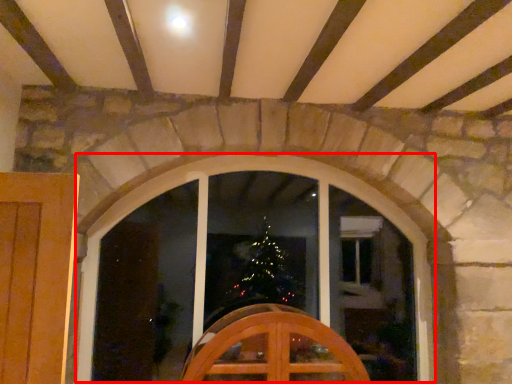
Question: In this image, where is window (annotated by the red box) located relative to furniture?

Choices:
 (A) right
 (B) left

Answer: (B)